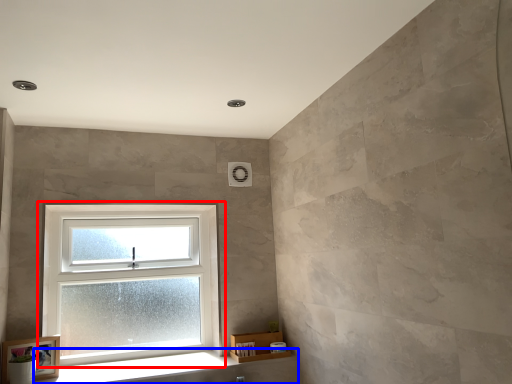
Question: Which of the following is the closest to the observer, window (highlighted by a red box) or window sill (highlighted by a blue box)?

Choices:
 (A) window
 (B) window sill

Answer: (B)